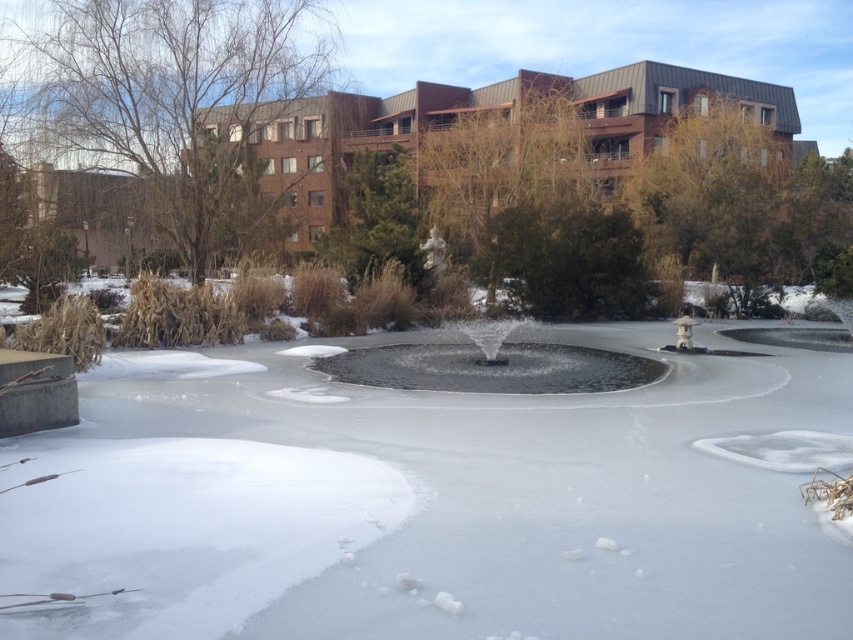
Looking at this image, you are planning to place a 10 meter long decorative fence between the brown textured tree at upper right and the green textured tree at center. Will the fence fit between them without needing to cut it?

The distance between the brown textured tree at upper right and the green textured tree at center is 10.77 meters. Since the fence is 10 meters long, it will fit between them with 0.77 meters of space remaining.

You are standing in the winter scene and want to take a photo of both the bare branches at upper left and the green textured tree at center. Which object should you adjust your camera to focus on first if you want both to be in the frame?

The bare branches at upper left is located above the green textured tree at center, so you should focus on the bare branches at upper left first to ensure both are in the frame.